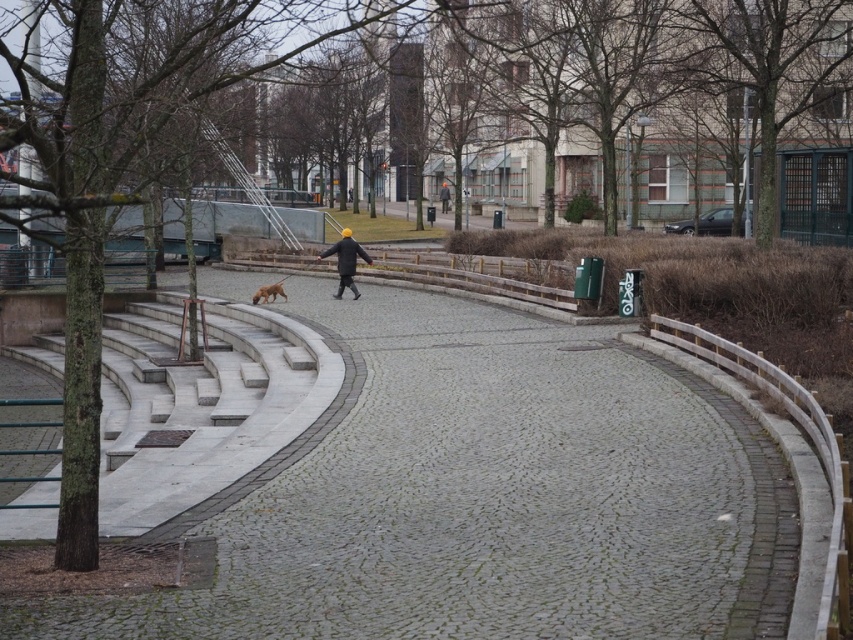
In the scene shown: You are a photographer trying to capture a shot of the matte black jacket at center and the white marble stairs at left. If you want to ensure both subjects are in focus, which one should you adjust your camera focus on first?

The white marble stairs at left is bigger than matte black jacket at center, so you should focus on the white marble stairs at left first to ensure both are in focus.

You are standing at the entrance of the park and see the white marble stairs at left and the brown fur dog at center. Which object is located to the left of the other?

The white marble stairs at left is positioned on the left side of brown fur dog at center.

You are standing at the starting point of the white marble stairs at left and want to reach the brown fur dog at center. Which direction should you walk to get there?

The white marble stairs at left is in front of brown fur dog at center, so you should walk backward to reach the brown fur dog at center.